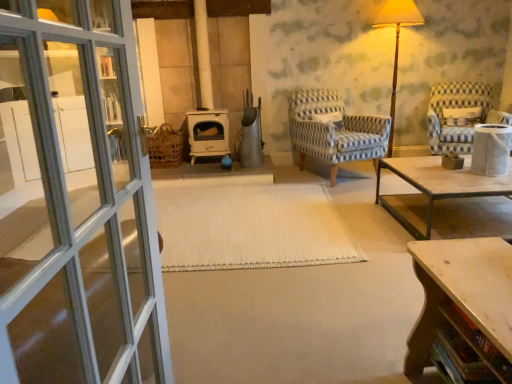
Question: Is wooden side table at right shorter than blue-patterned fabric chair at center, placed as the second chair when sorted from right to left?

Choices:
 (A) yes
 (B) no

Answer: (A)

Question: Is wooden side table at right at the right side of blue-patterned fabric chair at center, the 1th chair when ordered from left to right?

Choices:
 (A) yes
 (B) no

Answer: (A)

Question: Considering the relative sizes of wooden side table at right and blue-patterned fabric chair at center, placed as the second chair when sorted from right to left, in the image provided, is wooden side table at right bigger than blue-patterned fabric chair at center, placed as the second chair when sorted from right to left,?

Choices:
 (A) yes
 (B) no

Answer: (B)

Question: Is wooden side table at right in front of blue-patterned fabric chair at center, placed as the second chair when sorted from right to left?

Choices:
 (A) no
 (B) yes

Answer: (B)

Question: Considering the relative sizes of wooden side table at right and blue-patterned fabric chair at center, placed as the second chair when sorted from right to left, in the image provided, is wooden side table at right taller than blue-patterned fabric chair at center, placed as the second chair when sorted from right to left,?

Choices:
 (A) yes
 (B) no

Answer: (B)

Question: Is wooden side table at right in front of or behind blue and white patterned fabric armchair at right, which is the second chair in left-to-right order, in the image?

Choices:
 (A) behind
 (B) front

Answer: (B)

Question: From the image's perspective, is wooden side table at right above or below blue and white patterned fabric armchair at right, which is counted as the first chair, starting from the right?

Choices:
 (A) above
 (B) below

Answer: (B)

Question: Looking at the image, does wooden side table at right seem bigger or smaller compared to blue and white patterned fabric armchair at right, which is the second chair in left-to-right order?

Choices:
 (A) big
 (B) small

Answer: (B)

Question: Is point (493, 137) positioned closer to the camera than point (437, 114)?

Choices:
 (A) farther
 (B) closer

Answer: (B)

Question: In terms of height, does wooden table at lower right look taller or shorter compared to blue-patterned fabric chair at center, placed as the second chair when sorted from right to left?

Choices:
 (A) tall
 (B) short

Answer: (B)

Question: Is wooden table at lower right in front of or behind blue-patterned fabric chair at center, the 1th chair when ordered from left to right, in the image?

Choices:
 (A) behind
 (B) front

Answer: (B)

Question: From the image's perspective, relative to blue-patterned fabric chair at center, placed as the second chair when sorted from right to left, is wooden table at lower right above or below?

Choices:
 (A) above
 (B) below

Answer: (B)

Question: From a real-world perspective, relative to blue-patterned fabric chair at center, placed as the second chair when sorted from right to left, is wooden table at lower right vertically above or below?

Choices:
 (A) below
 (B) above

Answer: (A)

Question: Looking at the image, does blue and white patterned fabric armchair at right, which is the second chair in left-to-right order, seem bigger or smaller compared to wooden table at lower right?

Choices:
 (A) small
 (B) big

Answer: (B)

Question: Looking at their shapes, would you say blue and white patterned fabric armchair at right, which is counted as the first chair, starting from the right, is wider or thinner than wooden table at lower right?

Choices:
 (A) wide
 (B) thin

Answer: (A)